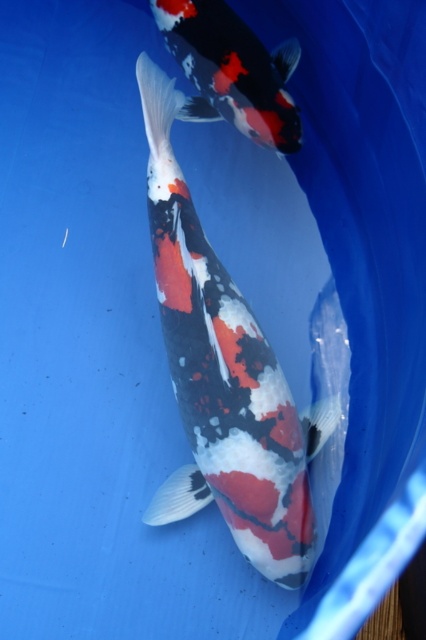
You are a photographer trying to capture the speckled white and black fish at center and the speckled white and black fish at upper center in a single shot. Based on their positions, which fish would appear closer to the camera lens?

The speckled white and black fish at center is located below the speckled white and black fish at upper center, so the fish at center is closer to the camera lens because it is positioned lower in the frame.

You are an aquarium caretaker who needs to ensure all fish are visible through the glass. The speckled white and black fish at center and the speckled white and black fish at upper center are both in the tank. Which fish is larger and might block the view of the smaller one?

The speckled white and black fish at center is bigger than the speckled white and black fish at upper center, so it might block the view of the smaller one.

You are a fisherman who wants to catch both the speckled white and black fish at center and the speckled white and black fish at upper center. The net you have can only cover a 10 inch area. Do you think you can catch both fish with one throw?

The distance between the speckled white and black fish at center and the speckled white and black fish at upper center is 10.72 inches, which is slightly larger than the 10 inch net. Therefore, it is not possible to catch both fish with one throw.